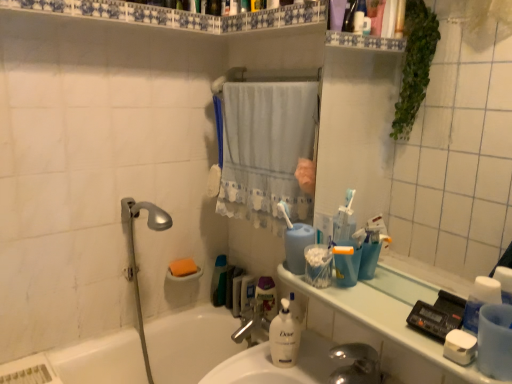
Where is `vacant area that lies in front of green plastic bottle at center`? vacant area that lies in front of green plastic bottle at center is located at coordinates (221, 316).